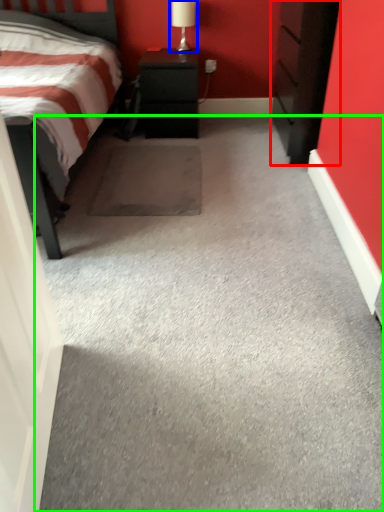
Question: Which is nearer to the chest of drawers (highlighted by a red box)? table lamp (highlighted by a blue box) or concrete (highlighted by a green box).

Choices:
 (A) table lamp
 (B) concrete

Answer: (A)